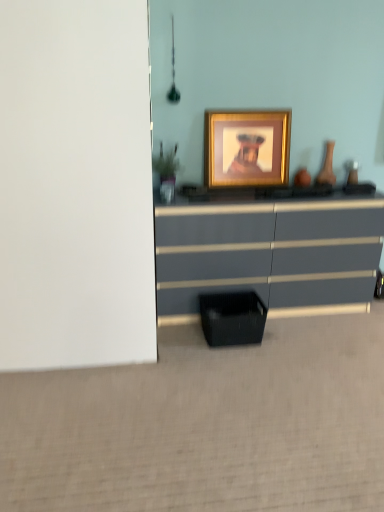
Question: Considering the relative sizes of matte gray chest of drawers at center and matte brown vase at right in the image provided, is matte gray chest of drawers at center thinner than matte brown vase at right?

Choices:
 (A) no
 (B) yes

Answer: (A)

Question: Is matte gray chest of drawers at center further to camera compared to matte brown vase at right?

Choices:
 (A) no
 (B) yes

Answer: (A)

Question: Is matte gray chest of drawers at center closer to the viewer compared to matte brown vase at right?

Choices:
 (A) no
 (B) yes

Answer: (B)

Question: From the image's perspective, is matte gray chest of drawers at center under matte brown vase at right?

Choices:
 (A) no
 (B) yes

Answer: (B)

Question: Is matte gray chest of drawers at center next to matte brown vase at right and touching it?

Choices:
 (A) yes
 (B) no

Answer: (B)

Question: From a real-world perspective, is matte gray chest of drawers at center located higher than matte brown vase at right?

Choices:
 (A) no
 (B) yes

Answer: (A)

Question: Considering the relative sizes of matte gray chest of drawers at center and green matte plant at left in the image provided, is matte gray chest of drawers at center smaller than green matte plant at left?

Choices:
 (A) no
 (B) yes

Answer: (A)

Question: Is matte gray chest of drawers at center next to green matte plant at left?

Choices:
 (A) yes
 (B) no

Answer: (B)

Question: Does matte gray chest of drawers at center appear on the left side of green matte plant at left?

Choices:
 (A) no
 (B) yes

Answer: (A)

Question: From the image's perspective, would you say matte gray chest of drawers at center is positioned over green matte plant at left?

Choices:
 (A) no
 (B) yes

Answer: (A)

Question: Would you say matte gray chest of drawers at center is outside green matte plant at left?

Choices:
 (A) no
 (B) yes

Answer: (B)

Question: Is matte gray chest of drawers at center further to camera compared to green matte plant at left?

Choices:
 (A) yes
 (B) no

Answer: (B)

Question: Is black mesh basket at lower center placed right next to green matte plant at left?

Choices:
 (A) yes
 (B) no

Answer: (B)